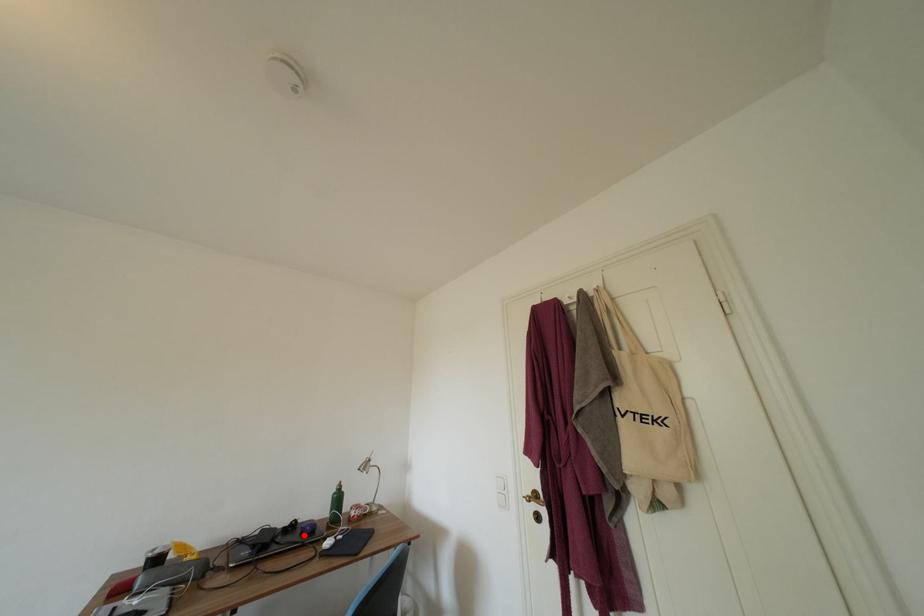
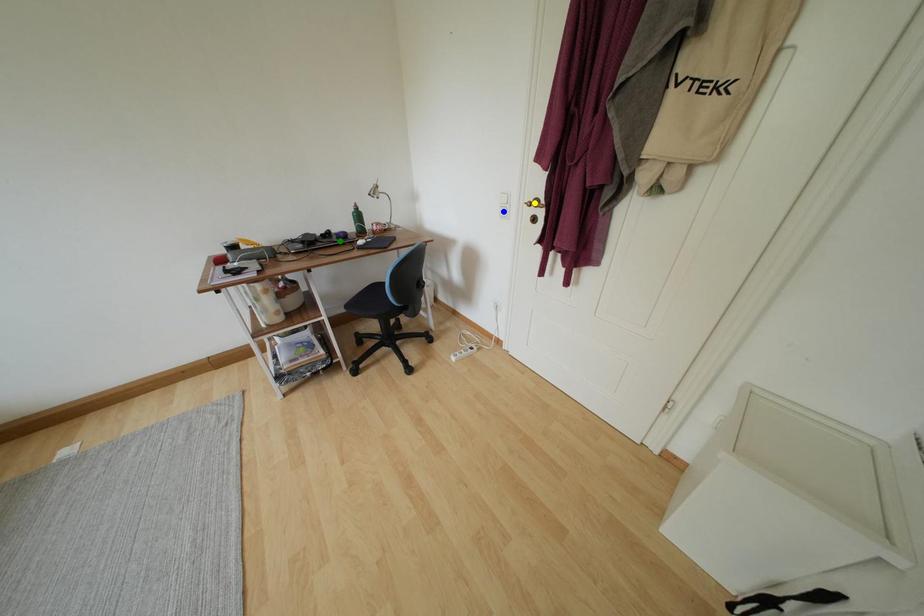
Question: I am providing you with two images of the same scene from different viewpoints. A red point is marked on the first image. You are given multiple points on the second image. Which point in image 2 is actually the same real-world point as the red point in image 1?

Choices:
 (A) green point
 (B) yellow point
 (C) blue point

Answer: (A)